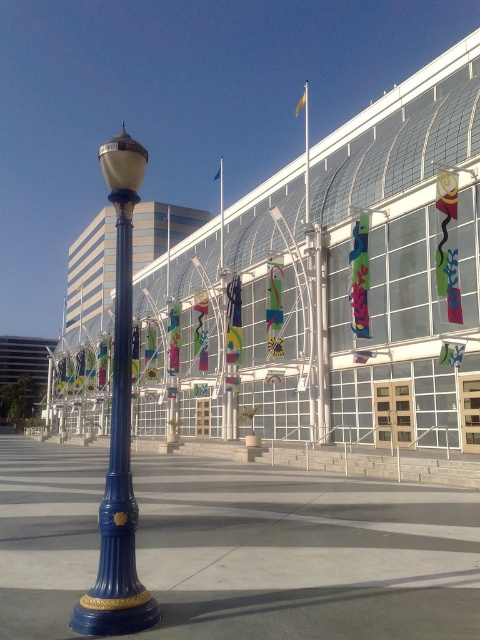
Question: Does blue glass building at center come behind blue glossy lamp post at left?

Choices:
 (A) yes
 (B) no

Answer: (A)

Question: Is blue concrete pavement at lower left smaller than blue glossy lamp post at left?

Choices:
 (A) no
 (B) yes

Answer: (B)

Question: Which point is farther to the camera?

Choices:
 (A) click(x=148, y=612)
 (B) click(x=193, y=333)
 (C) click(x=268, y=614)

Answer: (B)

Question: Which point is farther from the camera taking this photo?

Choices:
 (A) [233, 209]
 (B) [393, 538]

Answer: (A)

Question: Can you confirm if blue glass building at center is smaller than blue concrete pavement at lower left?

Choices:
 (A) yes
 (B) no

Answer: (B)

Question: Which point appears farthest from the camera in this image?

Choices:
 (A) (122, 360)
 (B) (192, 250)

Answer: (B)